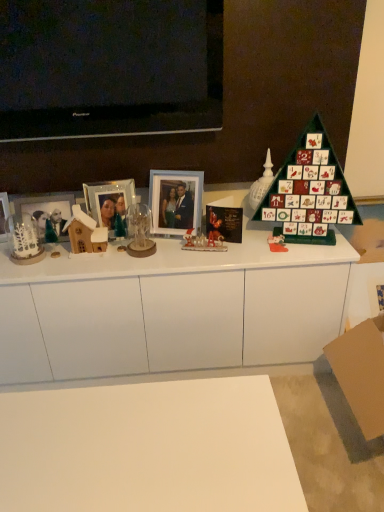
Question: Can you confirm if white glossy santa claus at center, the 3th toy in the right-to-left sequence, is taller than green matte advent calendar at right?

Choices:
 (A) yes
 (B) no

Answer: (B)

Question: Is white glossy santa claus at center, marked as the fourth toy in a left-to-right arrangement, at the right side of green matte advent calendar at right?

Choices:
 (A) no
 (B) yes

Answer: (A)

Question: Is white glossy santa claus at center, marked as the fourth toy in a left-to-right arrangement, oriented away from green matte advent calendar at right?

Choices:
 (A) no
 (B) yes

Answer: (A)

Question: Is white glossy santa claus at center, the 3th toy in the right-to-left sequence, surrounding green matte advent calendar at right?

Choices:
 (A) no
 (B) yes

Answer: (A)

Question: From a real-world perspective, is white glossy santa claus at center, marked as the fourth toy in a left-to-right arrangement, located beneath green matte advent calendar at right?

Choices:
 (A) no
 (B) yes

Answer: (B)

Question: In terms of height, does black paper christmas card at center look taller or shorter compared to brown cardboard at lower right?

Choices:
 (A) short
 (B) tall

Answer: (A)

Question: Considering the positions of black paper christmas card at center and brown cardboard at lower right in the image, is black paper christmas card at center bigger or smaller than brown cardboard at lower right?

Choices:
 (A) big
 (B) small

Answer: (B)

Question: From the image's perspective, is black paper christmas card at center above or below brown cardboard at lower right?

Choices:
 (A) above
 (B) below

Answer: (A)

Question: Is black paper christmas card at center to the left or to the right of brown cardboard at lower right in the image?

Choices:
 (A) right
 (B) left

Answer: (B)

Question: From a real-world perspective, is wooden house at left, which appears as the 5th toy when viewed from the right, above or below green wooden advent calendar at right, which is counted as the 2th toy, starting from the right?

Choices:
 (A) above
 (B) below

Answer: (B)

Question: In terms of width, does wooden house at left, which appears as the 2th toy when viewed from the left, look wider or thinner when compared to green wooden advent calendar at right, which is counted as the 2th toy, starting from the right?

Choices:
 (A) thin
 (B) wide

Answer: (A)

Question: From the image's perspective, relative to green wooden advent calendar at right, placed as the 5th toy when sorted from left to right, is wooden house at left, which appears as the 5th toy when viewed from the right, above or below?

Choices:
 (A) above
 (B) below

Answer: (B)

Question: Is wooden house at left, which appears as the 5th toy when viewed from the right, to the left or to the right of green wooden advent calendar at right, which is counted as the 2th toy, starting from the right, in the image?

Choices:
 (A) right
 (B) left

Answer: (B)

Question: From the image's perspective, is black paper christmas card at center located above or below white glossy cabinet at center?

Choices:
 (A) below
 (B) above

Answer: (B)

Question: From a real-world perspective, is black paper christmas card at center physically located above or below white glossy cabinet at center?

Choices:
 (A) above
 (B) below

Answer: (A)